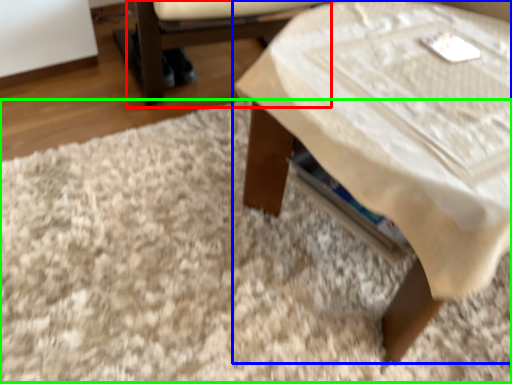
Question: Which object is positioned farthest from armchair (highlighted by a red box)? Select from table (highlighted by a blue box) and mat (highlighted by a green box).

Choices:
 (A) table
 (B) mat

Answer: (A)